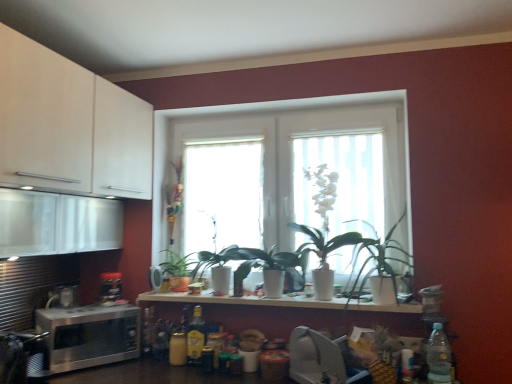
The height and width of the screenshot is (384, 512). Identify the location of free point above translucent glass window at center (from a real-world perspective). (224, 142).